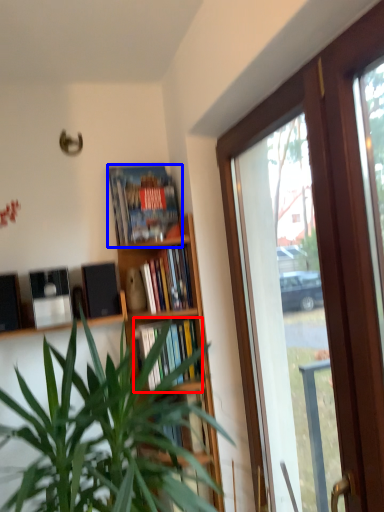
Question: Which of the following is the closest to the observer, book (highlighted by a red box) or book (highlighted by a blue box)?

Choices:
 (A) book
 (B) book

Answer: (B)